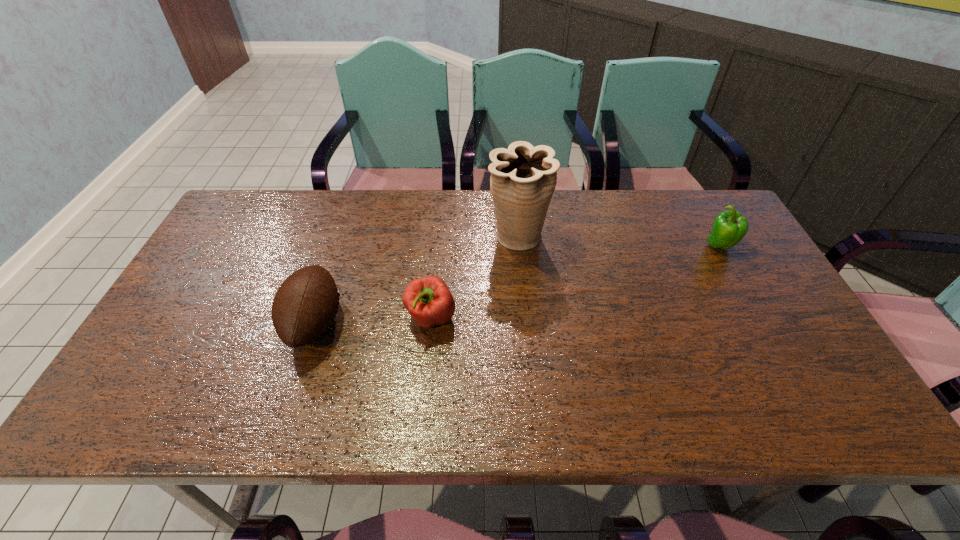
Image resolution: width=960 pixels, height=540 pixels. Identify the location of the tallest object. (523, 178).

You are a GUI agent. You are given a task and a screenshot of the screen. Output one action in this format:
    pyautogui.click(x=<x>, y=<y>)
    Task: Click on the urn
    Image resolution: width=960 pixels, height=540 pixels.
    Given the screenshot: What is the action you would take?
    coord(523,178)

Locate an element on the screen. the right bell pepper is located at coordinates (729, 227).

Where is `the farther bell pepper`? the farther bell pepper is located at coordinates (729, 227).

I want to click on football, so click(x=305, y=305).

Locate an element on the screen. The width and height of the screenshot is (960, 540). the shorter bell pepper is located at coordinates (428, 300).

This screenshot has height=540, width=960. I want to click on the second object from left to right, so click(428, 300).

Locate an element on the screen. The image size is (960, 540). free region located 0.170m on the front of the second object from right to left is located at coordinates (523, 305).

Find the location of a particular element. The height and width of the screenshot is (540, 960). vacant position located 0.050m on the back of the taller bell pepper is located at coordinates (708, 226).

The width and height of the screenshot is (960, 540). I want to click on vacant region located on the laces of the leftmost object, so click(x=395, y=323).